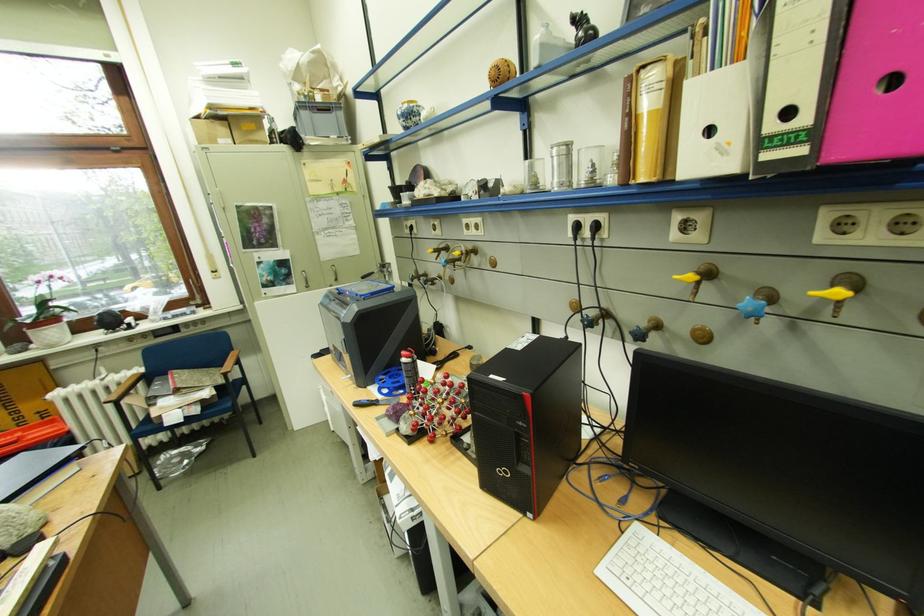
Find where to pull the white binder hole. Please return your answer as a coordinate pair (x, y).

(664, 580)